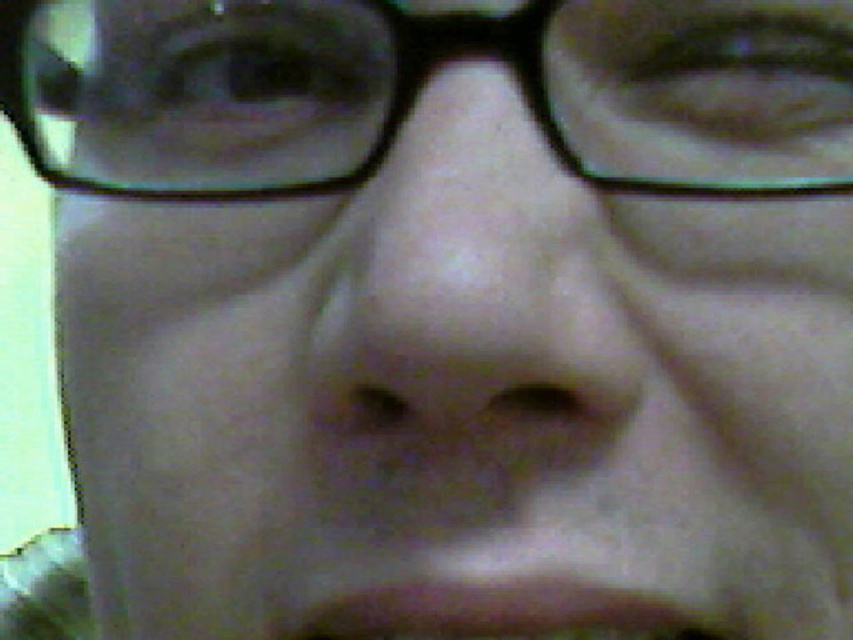
Question: Which of the following is the farthest from the observer?

Choices:
 (A) (316, 147)
 (B) (334, 634)

Answer: (A)

Question: Which point is closer to the camera taking this photo?

Choices:
 (A) (483, 636)
 (B) (782, 61)

Answer: (A)

Question: Can you confirm if transparent plastic glasses at upper center is thinner than brown matte mouth at lower center?

Choices:
 (A) no
 (B) yes

Answer: (A)

Question: From the image, what is the correct spatial relationship of transparent plastic glasses at upper center in relation to brown matte mouth at lower center?

Choices:
 (A) right
 (B) left

Answer: (B)

Question: Among these objects, which one is nearest to the camera?

Choices:
 (A) brown matte mouth at lower center
 (B) transparent plastic glasses at upper center

Answer: (B)

Question: Where is transparent plastic glasses at upper center located in relation to brown matte mouth at lower center in the image?

Choices:
 (A) above
 (B) below

Answer: (A)